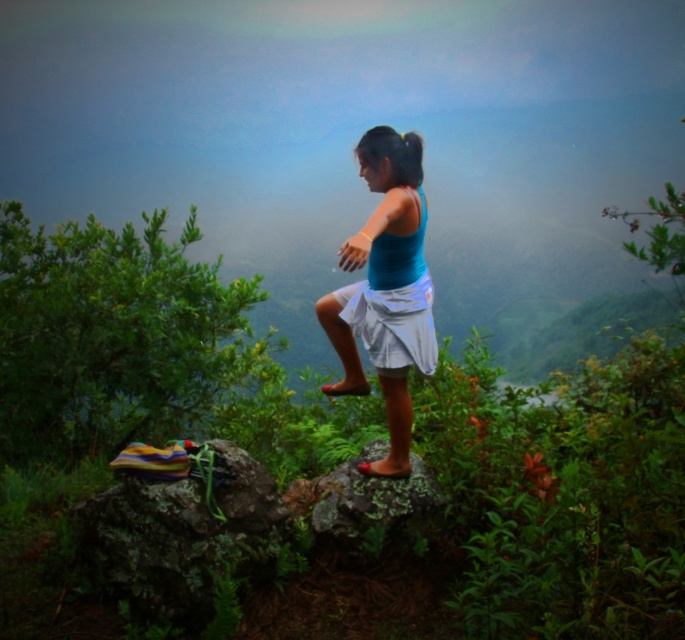
Question: Is green leafy bush at center below green mossy rock at center?

Choices:
 (A) yes
 (B) no

Answer: (B)

Question: Which point is farther from the camera taking this photo?

Choices:
 (A) (332, 461)
 (B) (342, 474)
 (C) (119, 492)
 (D) (399, 330)

Answer: (A)

Question: Is the position of green leafy bush at center less distant than that of multicolored fabric at center?

Choices:
 (A) yes
 (B) no

Answer: (B)

Question: Is multicolored fabric at center further to the viewer compared to blue fabric skirt at center?

Choices:
 (A) yes
 (B) no

Answer: (A)

Question: Which point appears closest to the camera in this image?

Choices:
 (A) (190, 525)
 (B) (429, 524)
 (C) (264, 449)

Answer: (A)

Question: Which of the following is the farthest from the observer?

Choices:
 (A) (388, 260)
 (B) (77, 298)
 (C) (216, 522)

Answer: (B)